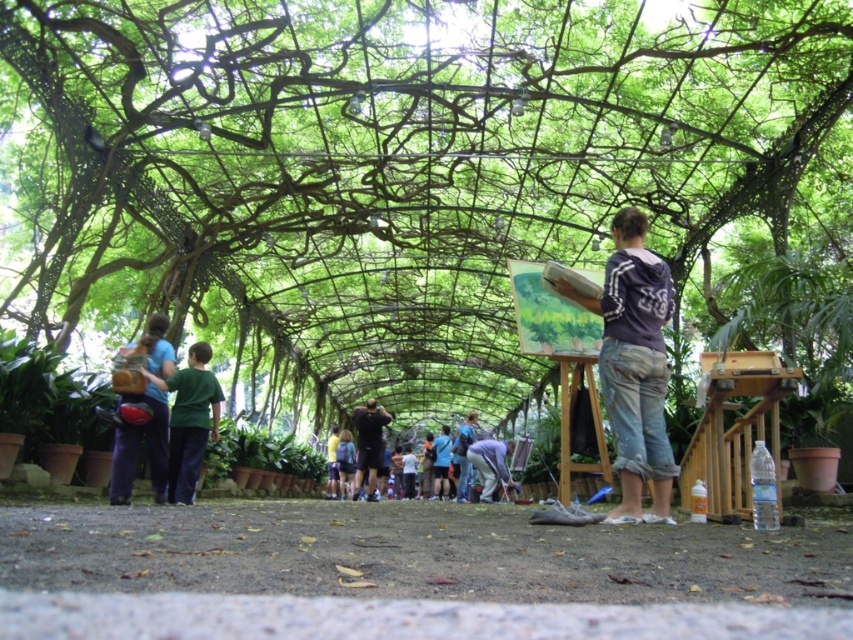
Question: Which point is farther from the camera taking this photo?

Choices:
 (A) (352, 476)
 (B) (358, 410)
 (C) (756, 29)

Answer: (A)

Question: Does blue fabric shirt at center lie in front of light blue denim jeans at center?

Choices:
 (A) yes
 (B) no

Answer: (A)

Question: Among these points, which one is nearest to the camera?

Choices:
 (A) (288, 116)
 (B) (206, 349)
 (C) (131, 428)
 (D) (328, 464)

Answer: (C)

Question: Is blue fabric shirt at center below yellow shirt at center?

Choices:
 (A) no
 (B) yes

Answer: (A)

Question: Can you confirm if white hoodie at center is positioned to the right of blue backpack at center?

Choices:
 (A) no
 (B) yes

Answer: (B)

Question: Which object appears farthest from the camera in this image?

Choices:
 (A) yellow shirt at center
 (B) light blue denim jeans at center

Answer: (B)